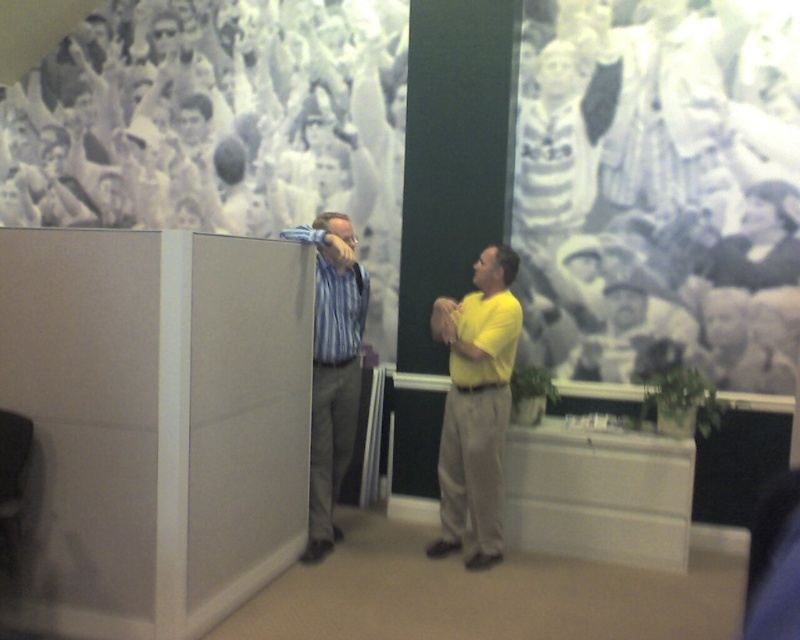
Question: From the image, what is the correct spatial relationship of yellow matte shirt at center in relation to blue striped dress shirt at left?

Choices:
 (A) above
 (B) below

Answer: (B)

Question: Is the position of yellow matte shirt at center less distant than that of blue striped shirt at left?

Choices:
 (A) no
 (B) yes

Answer: (A)

Question: Which object is farther from the camera taking this photo?

Choices:
 (A) blue striped dress shirt at left
 (B) yellow matte shirt at center
 (C) blue striped shirt at left

Answer: (B)

Question: Which point is closer to the camera taking this photo?

Choices:
 (A) (324, 346)
 (B) (322, 460)
 (C) (474, 378)

Answer: (C)

Question: Which object is positioned closest to the yellow matte shirt at center?

Choices:
 (A) blue striped shirt at left
 (B) blue striped dress shirt at left

Answer: (B)

Question: Where is blue striped dress shirt at left located in relation to blue striped shirt at left in the image?

Choices:
 (A) right
 (B) left

Answer: (B)